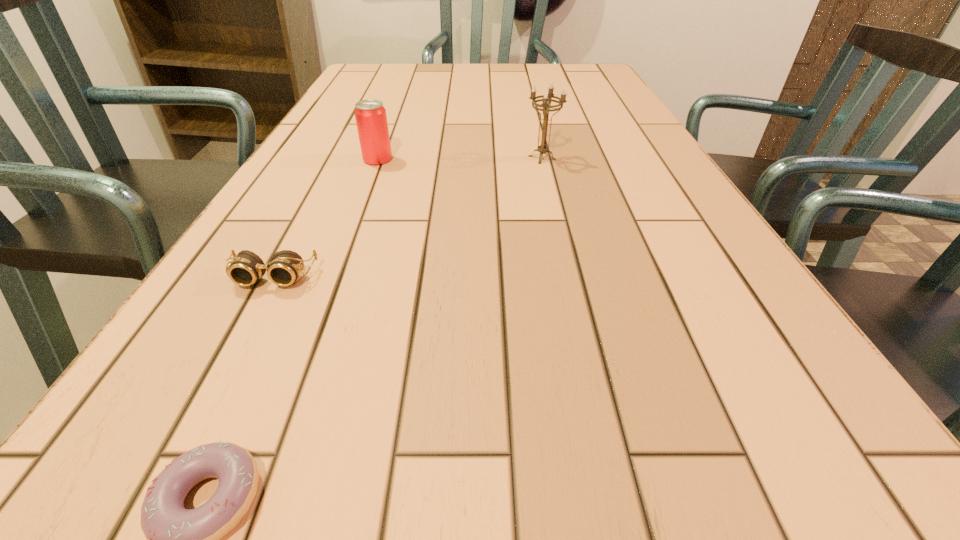
The width and height of the screenshot is (960, 540). In the image, there is a desktop. Identify the location of vacant space at the far edge. (404, 83).

At what (x,y) coordinates should I click in order to perform the action: click on vacant space at the left edge of the desktop. Please return your answer as a coordinate pair (x, y). Image resolution: width=960 pixels, height=540 pixels. Looking at the image, I should click on (347, 136).

Where is `free region at the right edge of the desktop`? free region at the right edge of the desktop is located at coordinates (773, 426).

I want to click on free location at the far right corner of the desktop, so click(x=594, y=76).

The width and height of the screenshot is (960, 540). I want to click on free space between the tallest object and the can, so coord(460,159).

In order to click on free space between the candle holder and the third farthest object in this screenshot , I will do `click(408, 218)`.

Locate an element on the screen. This screenshot has height=540, width=960. vacant area that lies between the can and the second nearest object is located at coordinates (325, 219).

The width and height of the screenshot is (960, 540). Find the location of `vacant area between the second tallest object and the candle holder`. vacant area between the second tallest object and the candle holder is located at coordinates (460, 159).

The height and width of the screenshot is (540, 960). I want to click on empty space between the candle holder and the third shortest object, so click(460, 159).

Locate which object is the third closest to the can. Please provide its 2D coordinates. Your answer should be formatted as a tuple, i.e. [(x, y)], where the tuple contains the x and y coordinates of a point satisfying the conditions above.

[(177, 539)]